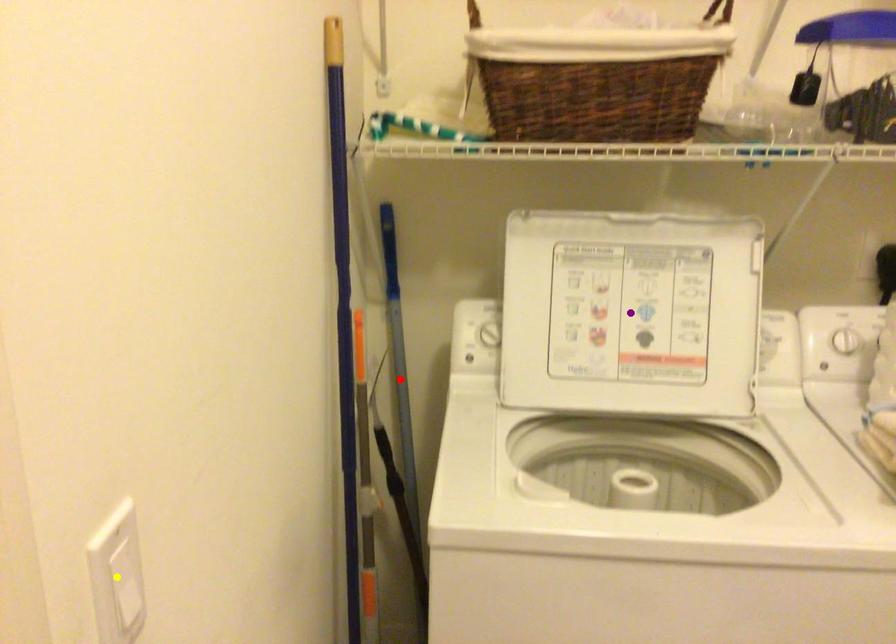
Order these from farthest to nearest:
yellow point, red point, purple point

red point, purple point, yellow point